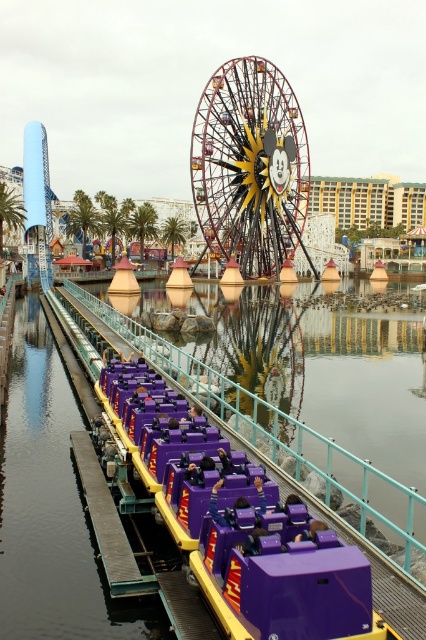
Question: Which object is closer to the camera taking this photo?

Choices:
 (A) metallic yellow ferris wheel at center
 (B) smooth gray dock at lower left
 (C) purple plastic waterway at center
 (D) metallic yellow wheel at center

Answer: (C)

Question: Which object appears farthest from the camera in this image?

Choices:
 (A) smooth gray dock at lower left
 (B) purple plastic waterway at center
 (C) metallic yellow wheel at center

Answer: (A)

Question: Which point is farther to the camera?

Choices:
 (A) coord(198,588)
 (B) coord(85,451)

Answer: (B)

Question: Can you confirm if metallic yellow ferris wheel at center is positioned above smooth gray dock at lower left?

Choices:
 (A) yes
 (B) no

Answer: (A)

Question: Is metallic yellow ferris wheel at center to the left of smooth gray dock at lower left from the viewer's perspective?

Choices:
 (A) yes
 (B) no

Answer: (B)

Question: Can you confirm if smooth gray dock at lower left is positioned above metallic yellow wheel at center?

Choices:
 (A) yes
 (B) no

Answer: (A)